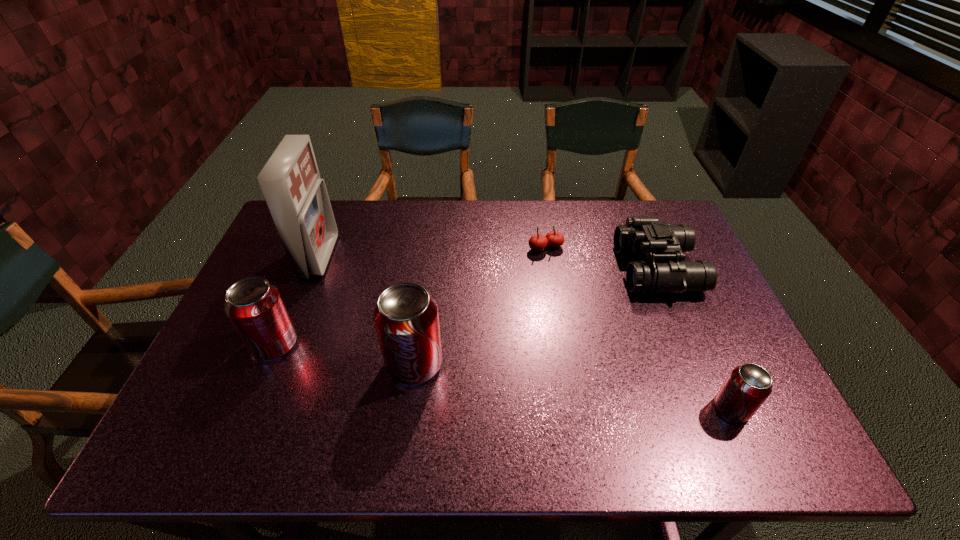
Where is `soda can at the left edge`? The width and height of the screenshot is (960, 540). soda can at the left edge is located at coordinates (254, 306).

This screenshot has height=540, width=960. Identify the location of the first-aid kit at the left edge. (297, 198).

Locate an element on the screen. The height and width of the screenshot is (540, 960). soda can located at the right edge is located at coordinates (747, 387).

Where is `binoculars situated at the right edge`? The height and width of the screenshot is (540, 960). binoculars situated at the right edge is located at coordinates (647, 236).

You are a GUI agent. You are given a task and a screenshot of the screen. Output one action in this format:
    pyautogui.click(x=<x>, y=<y>)
    Task: Click on the object present at the far left corner
    
    Given the screenshot: What is the action you would take?
    pyautogui.click(x=297, y=198)

Where is `object that is at the far right corner`? This screenshot has height=540, width=960. object that is at the far right corner is located at coordinates (647, 236).

This screenshot has height=540, width=960. I want to click on object at the near right corner, so click(747, 387).

Find the location of a particular element. This screenshot has height=540, width=960. vacant space at the far edge is located at coordinates (386, 210).

Locate an element on the screen. The width and height of the screenshot is (960, 540). vacant region at the near edge of the desktop is located at coordinates (594, 381).

In the image, there is a desktop. Where is `vacant space at the left edge`? vacant space at the left edge is located at coordinates (270, 246).